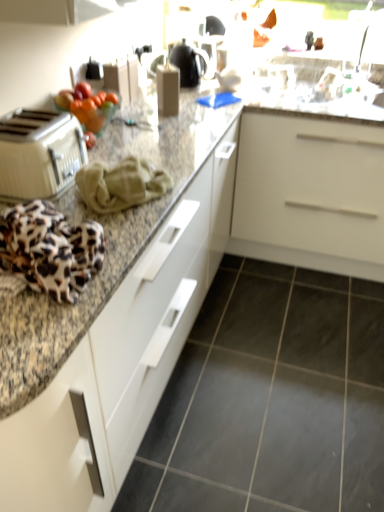
Question: Is white matte cabinet at center at the left side of shiny glass bowl of fruits at upper left?

Choices:
 (A) no
 (B) yes

Answer: (A)

Question: Would you say white matte cabinet at center is outside shiny glass bowl of fruits at upper left?

Choices:
 (A) yes
 (B) no

Answer: (A)

Question: Does white matte cabinet at center have a smaller size compared to shiny glass bowl of fruits at upper left?

Choices:
 (A) yes
 (B) no

Answer: (B)

Question: From the image's perspective, would you say white matte cabinet at center is positioned over shiny glass bowl of fruits at upper left?

Choices:
 (A) yes
 (B) no

Answer: (B)

Question: From a real-world perspective, is white matte cabinet at center located beneath shiny glass bowl of fruits at upper left?

Choices:
 (A) no
 (B) yes

Answer: (B)

Question: Is white matte cabinet at center next to shiny glass bowl of fruits at upper left and touching it?

Choices:
 (A) no
 (B) yes

Answer: (A)

Question: From a real-world perspective, does granite countertop at center sit lower than gray tile floor at lower center?

Choices:
 (A) yes
 (B) no

Answer: (B)

Question: Does granite countertop at center have a lesser height compared to gray tile floor at lower center?

Choices:
 (A) no
 (B) yes

Answer: (A)

Question: Is granite countertop at center beside gray tile floor at lower center?

Choices:
 (A) yes
 (B) no

Answer: (B)

Question: Is granite countertop at center bigger than gray tile floor at lower center?

Choices:
 (A) yes
 (B) no

Answer: (A)

Question: Considering the relative sizes of granite countertop at center and gray tile floor at lower center in the image provided, is granite countertop at center wider than gray tile floor at lower center?

Choices:
 (A) no
 (B) yes

Answer: (A)

Question: Is granite countertop at center oriented away from gray tile floor at lower center?

Choices:
 (A) yes
 (B) no

Answer: (B)

Question: Is beige plastic toaster at left at the right side of granite countertop at center?

Choices:
 (A) yes
 (B) no

Answer: (B)